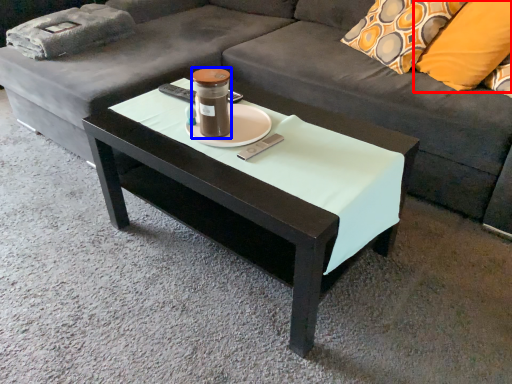
Question: Which point is closer to the camera, pillow (highlighted by a red box) or candle holder (highlighted by a blue box)?

Choices:
 (A) pillow
 (B) candle holder

Answer: (B)